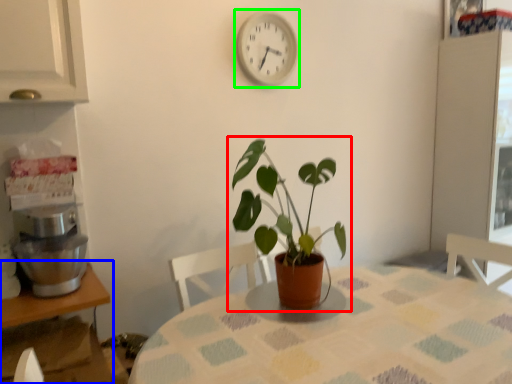
Question: Which object is positioned closest to houseplant (highlighted by a red box)? Select from table (highlighted by a blue box) and clock (highlighted by a green box).

Choices:
 (A) table
 (B) clock

Answer: (A)